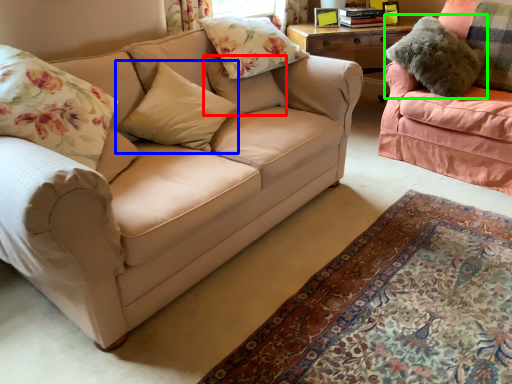
Question: Which is farther away from pillow (highlighted by a red box)? pillow (highlighted by a blue box) or pillow (highlighted by a green box)?

Choices:
 (A) pillow
 (B) pillow

Answer: (B)